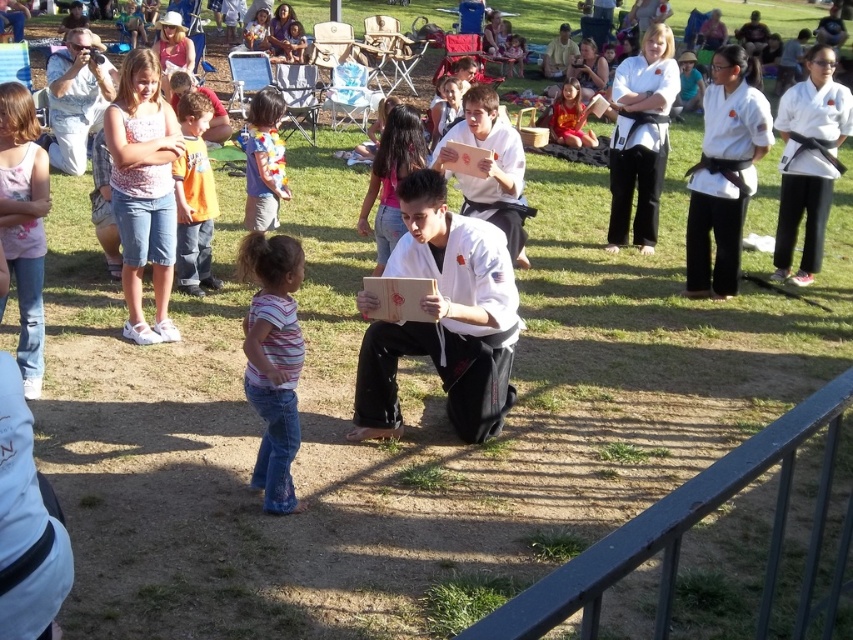
You are a photographer at the event and want to take a photo that includes both the metallic gray rail at lower right and the orange cotton shirt at upper left. Which object will appear larger in the photo?

The metallic gray rail at lower right will appear larger in the photo because it is closer to the viewer than the orange cotton shirt at upper left.